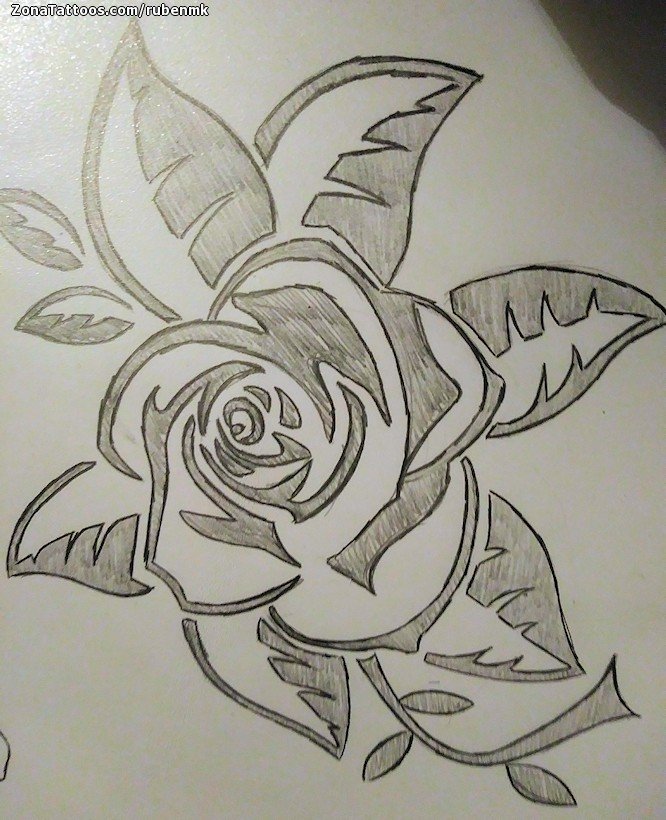
Find the location of a particular element. This screenshot has height=820, width=666. dark corner is located at coordinates (627, 30).